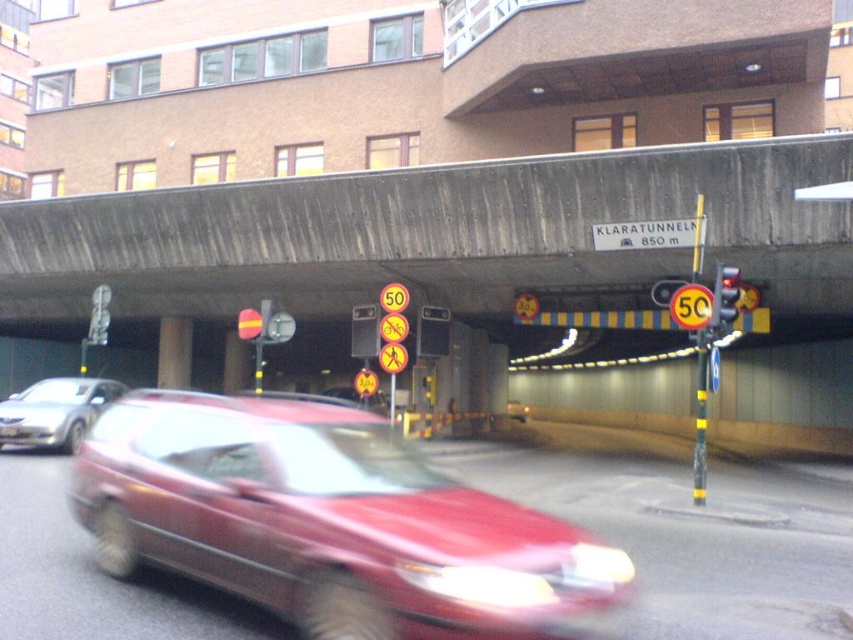
Does metallic pole at right have a lesser width compared to yellow reflective circle at center?

In fact, metallic pole at right might be wider than yellow reflective circle at center.

Describe the element at coordinates (700, 419) in the screenshot. I see `metallic pole at right` at that location.

Between point (699, 193) and point (407, 292), which one is positioned behind?

The point (407, 292) is more distant.

Find the location of a particular element. metallic pole at right is located at coordinates (700, 419).

How distant is concrete overpass at center from yellow reflective circle at center?

concrete overpass at center and yellow reflective circle at center are 20.82 feet apart.

Does concrete overpass at center have a greater width compared to yellow reflective circle at center?

Yes, concrete overpass at center is wider than yellow reflective circle at center.

Describe the element at coordinates (434, 232) in the screenshot. I see `concrete overpass at center` at that location.

Find the location of a particular element. The image size is (853, 640). concrete overpass at center is located at coordinates (434, 232).

Which is more to the left, silver metallic sedan at left or yellow reflective pedestrian crossing sign at center?

From the viewer's perspective, silver metallic sedan at left appears more on the left side.

Does silver metallic sedan at left appear on the right side of yellow reflective pedestrian crossing sign at center?

Incorrect, silver metallic sedan at left is not on the right side of yellow reflective pedestrian crossing sign at center.

Locate an element on the screen. The height and width of the screenshot is (640, 853). silver metallic sedan at left is located at coordinates (54, 412).